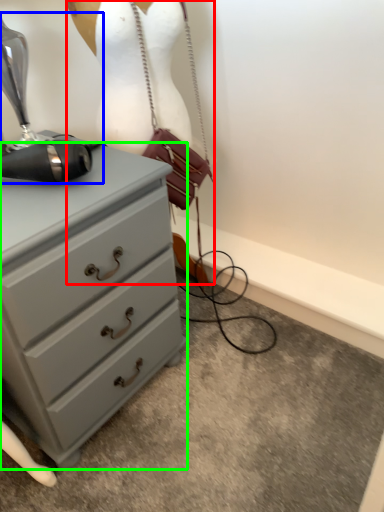
Question: Which object is positioned closest to mannequin (highlighted by a red box)? Select from sewing machine (highlighted by a blue box) and chest of drawers (highlighted by a green box).

Choices:
 (A) sewing machine
 (B) chest of drawers

Answer: (A)